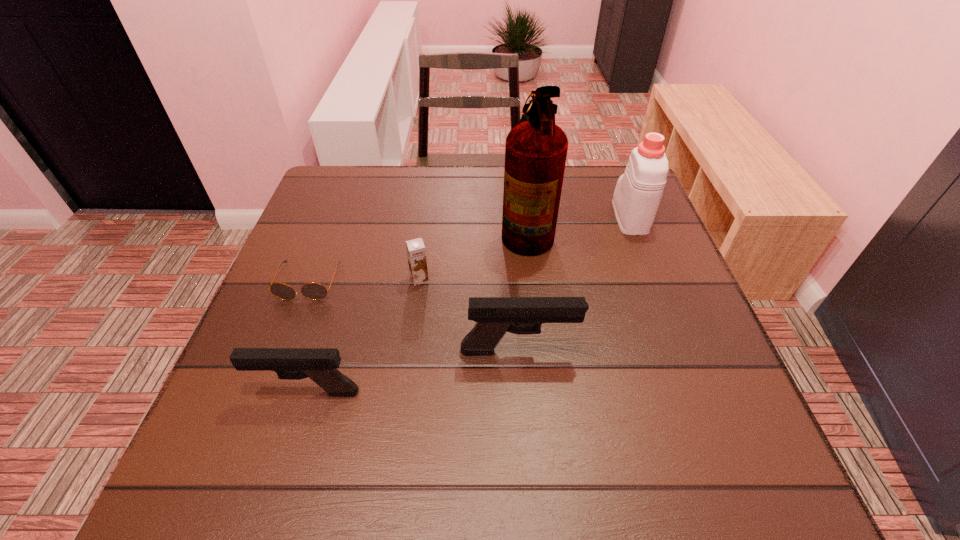
Locate an element on the screen. vacant space positioned at the nozzle of the tallest object is located at coordinates (406, 227).

This screenshot has height=540, width=960. What are the coordinates of `vacant region located 0.220m at the nozzle of the tallest object` in the screenshot? It's located at (414, 227).

Locate an element on the screen. The image size is (960, 540). blank space located at the nozzle of the tallest object is located at coordinates (469, 227).

The image size is (960, 540). I want to click on vacant space located 0.150m on the handle side of the detergent, so click(612, 170).

At what (x,y) coordinates should I click in order to perform the action: click on vacant space located on the handle side of the detergent. Please return your answer as a coordinate pair (x, y). Image resolution: width=960 pixels, height=540 pixels. Looking at the image, I should click on (612, 172).

Locate an element on the screen. The width and height of the screenshot is (960, 540). vacant space located on the lenses of the sunglasses is located at coordinates (262, 404).

This screenshot has height=540, width=960. Identify the location of vacant region located 0.180m on the left of the fourth object from right to left. (329, 279).

Find the location of a particular element. The height and width of the screenshot is (540, 960). fire extinguisher that is at the far edge is located at coordinates (536, 149).

Where is `detergent that is positioned at the far edge`? Image resolution: width=960 pixels, height=540 pixels. detergent that is positioned at the far edge is located at coordinates (638, 192).

Where is `object that is at the near edge`? The image size is (960, 540). object that is at the near edge is located at coordinates (319, 364).